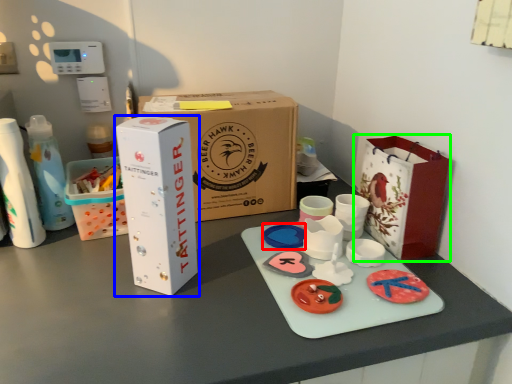
Question: Based on their relative distances, which object is farther from toy (highlighted by a red box)? Choose from box (highlighted by a blue box) and paper bag (highlighted by a green box).

Choices:
 (A) box
 (B) paper bag

Answer: (A)